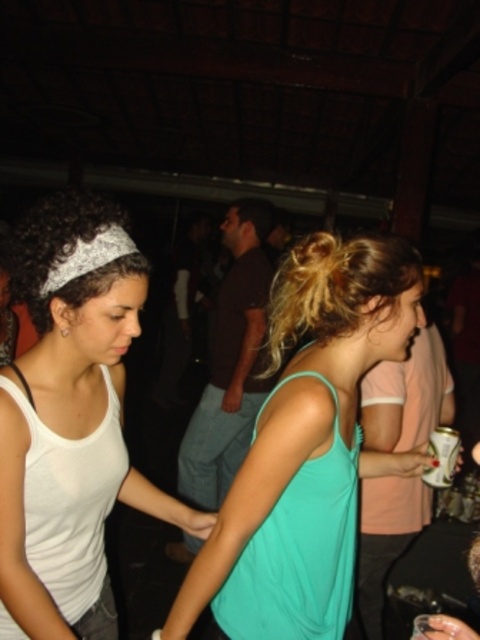
Does teal fabric tank top at center appear over white fabric tank top at left?

No.

Image resolution: width=480 pixels, height=640 pixels. What do you see at coordinates (305, 445) in the screenshot?
I see `teal fabric tank top at center` at bounding box center [305, 445].

Find the location of a particular element. This screenshot has height=640, width=480. teal fabric tank top at center is located at coordinates (305, 445).